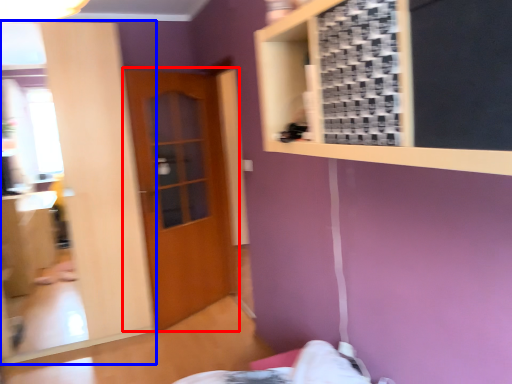
Question: Which object appears farthest to the camera in this image, door (highlighted by a red box) or mirror (highlighted by a blue box)?

Choices:
 (A) door
 (B) mirror

Answer: (A)